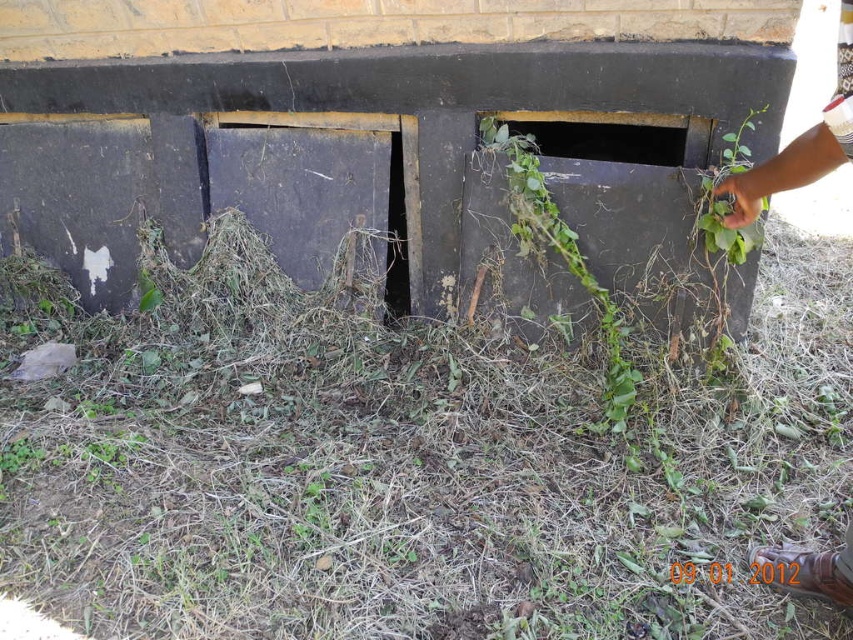
Which is in front, point (523, 177) or point (648, 150)?

Point (523, 177)

Can you confirm if green leafy plant at center is smaller than green leafy hole at center?

Actually, green leafy plant at center might be larger than green leafy hole at center.

Does point (634, 387) come in front of point (556, 132)?

Yes, it is in front of point (556, 132).

The image size is (853, 640). What are the coordinates of `green leafy plant at center` in the screenshot? It's located at (561, 259).

Is green leafy hand at right bigger than green leafy plant at upper right?

Correct, green leafy hand at right is larger in size than green leafy plant at upper right.

Is green leafy hand at right wider than green leafy plant at upper right?

Yes, green leafy hand at right is wider than green leafy plant at upper right.

Does point (837, 45) lie behind point (738, 157)?

That is True.

Image resolution: width=853 pixels, height=640 pixels. Identify the location of green leafy hand at right. 801,144.

Who is taller, green leafy hand at right or green leafy hole at center?

green leafy hand at right

Between point (822, 115) and point (640, 129), which one is positioned in front?

Point (822, 115) is more forward.

The image size is (853, 640). I want to click on green leafy hand at right, so click(x=801, y=144).